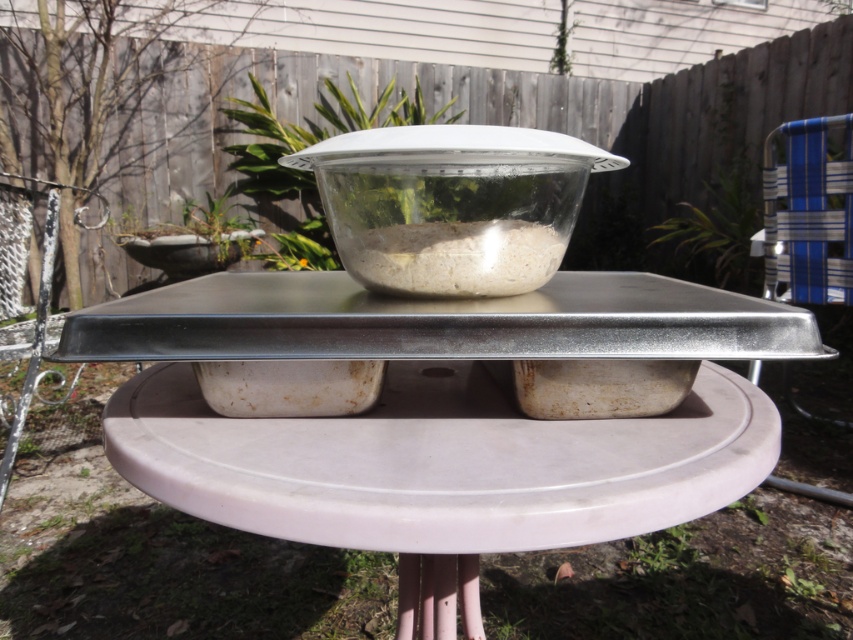
Question: In this image, where is metallic gray tray at center located relative to translucent glass bowl at center?

Choices:
 (A) above
 (B) below

Answer: (B)

Question: Does metallic gray tray at center lie in front of translucent glass bowl at center?

Choices:
 (A) no
 (B) yes

Answer: (B)

Question: Among these objects, which one is farthest from the camera?

Choices:
 (A) translucent glass bowl at center
 (B) metallic gray tray at center

Answer: (A)

Question: Can you confirm if metallic gray tray at center is wider than translucent glass bowl at center?

Choices:
 (A) yes
 (B) no

Answer: (A)

Question: Which of the following is the closest to the observer?

Choices:
 (A) metallic gray tray at center
 (B) translucent glass bowl at center

Answer: (A)

Question: Which of the following is the farthest from the observer?

Choices:
 (A) (358, 276)
 (B) (634, 275)

Answer: (B)